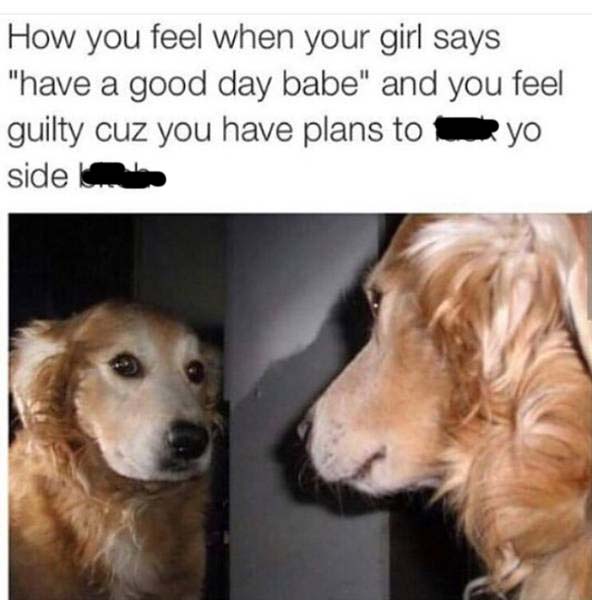
Identify the location of length of wall. This screenshot has width=592, height=600. (227, 212), (379, 214), (388, 596), (229, 592).